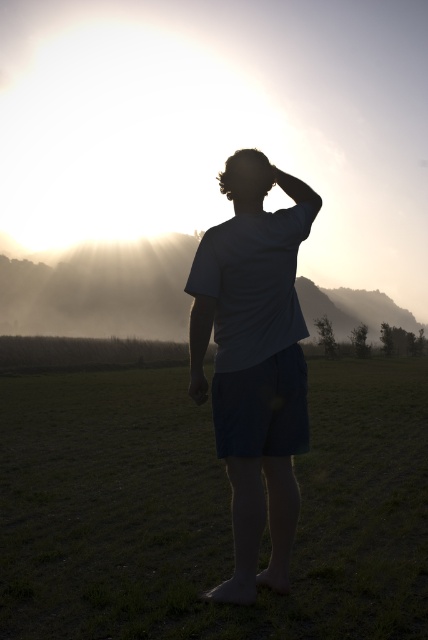
Can you confirm if green grass at center is positioned above gray cotton shirt at center?

No.

Does green grass at center have a smaller size compared to gray cotton shirt at center?

No, green grass at center is not smaller than gray cotton shirt at center.

Describe the element at coordinates (208, 509) in the screenshot. I see `green grass at center` at that location.

Find the location of `green grass at center`. green grass at center is located at coordinates (208, 509).